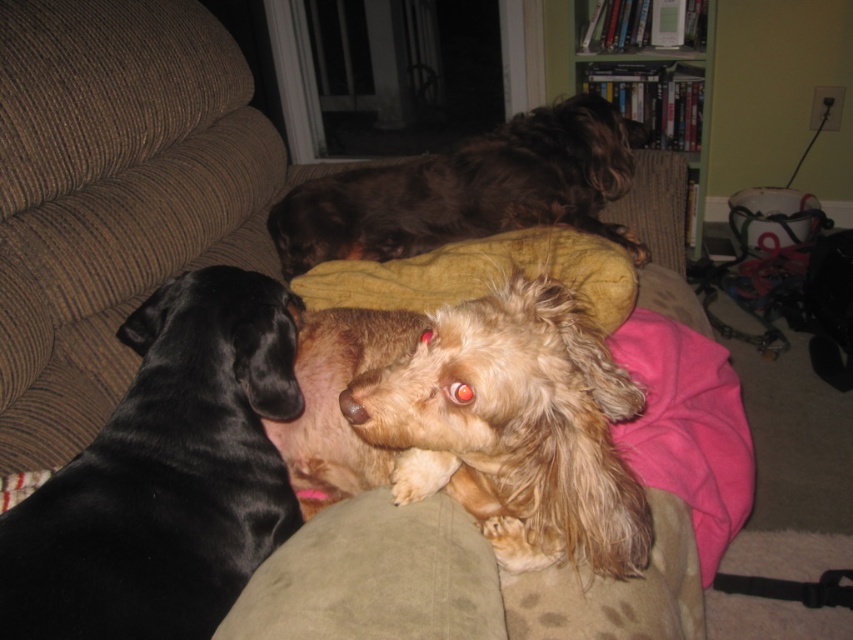
You are a photographer trying to capture a clear shot of the fuzzy brown dog at center and the shiny brown fur at upper center. Which dog should you focus on first to ensure both are in focus?

You should focus on the fuzzy brown dog at center first because it is closer to the viewer than the shiny brown fur at upper center, so adjusting focus from near to far will help both be in focus.

You are a photographer trying to capture a clear shot of the fuzzy brown dog at center and the shiny brown fur at upper center. Based on their heights, which dog should you adjust your camera angle to focus on first to ensure both are in frame?

The fuzzy brown dog at center is shorter than the shiny brown fur at upper center. To ensure both are in frame, adjust your camera angle to focus on the taller shiny brown fur at upper center first, then lower slightly to include the shorter fuzzy brown dog at center.

You are a photographer trying to capture all three dogs on the couch. Given that the fuzzy brown dog at center is smaller than the shiny brown fur at upper center, which dog should you focus on to ensure both fit in the frame without overcrowding?

The fuzzy brown dog at center occupies less space than the shiny brown fur at upper center, so focusing on the larger shiny brown fur at upper center would allow both to fit better in the frame without overcrowding.